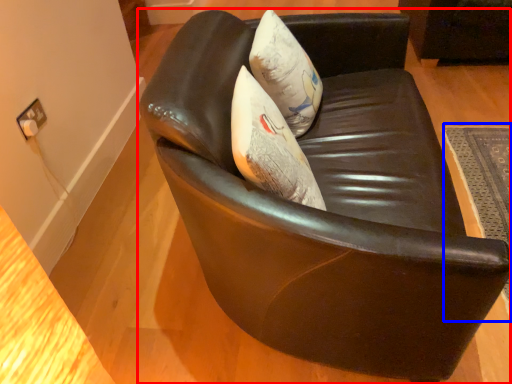
Question: Which object appears farthest to the camera in this image, chair (highlighted by a red box) or mat (highlighted by a blue box)?

Choices:
 (A) chair
 (B) mat

Answer: (B)